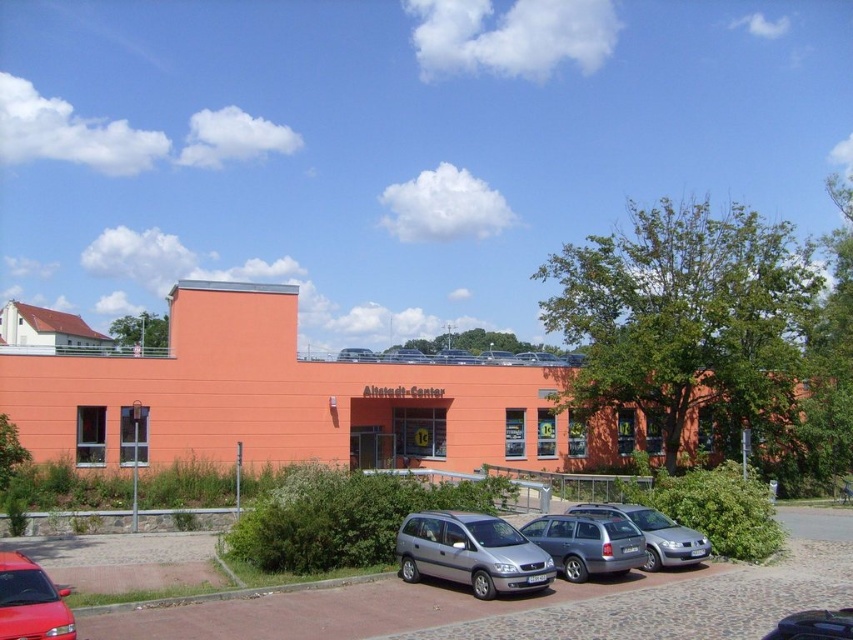
Which is above, shiny red car at lower left or silver metallic hatchback at lower right?

Positioned higher is shiny red car at lower left.

Between point (4, 618) and point (675, 554), which one is positioned in front?

Positioned in front is point (4, 618).

Locate an element on the screen. shiny red car at lower left is located at coordinates (x=32, y=602).

Which is more to the left, satin silver minivan at center or shiny red car at lower left?

shiny red car at lower left is more to the left.

Looking at this image, is satin silver minivan at center above shiny red car at lower left?

Incorrect, satin silver minivan at center is not positioned above shiny red car at lower left.

This screenshot has height=640, width=853. Describe the element at coordinates (469, 552) in the screenshot. I see `satin silver minivan at center` at that location.

Where is `satin silver minivan at center`? This screenshot has height=640, width=853. satin silver minivan at center is located at coordinates (469, 552).

Does silver metallic car at lower center have a smaller size compared to shiny red car at lower left?

Actually, silver metallic car at lower center might be larger than shiny red car at lower left.

Is point (782, 508) positioned after point (21, 612)?

That is True.

Identify the location of silver metallic car at lower center. (534, 602).